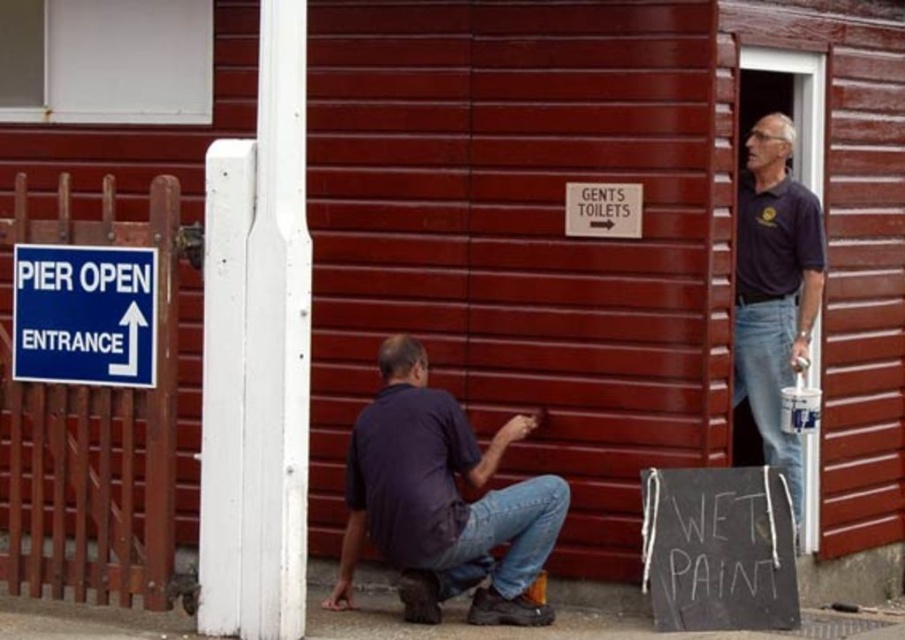
You are standing in front of the wooden building and want to read the blue plastic sign at upper left. Is the dark blue shirt at upper right blocking your view of the sign?

The dark blue shirt at upper right is further to the viewer than the blue plastic sign at upper left, so the dark blue shirt at upper right is closer to you and would block your view of the blue plastic sign at upper left.

You are a painter working on the red wooden structure. You notice the matte dark blue shirt at center and the blue plastic sign at upper left. Which object is wider from your current viewpoint?

The matte dark blue shirt at center might be wider than blue plastic sign at upper left according to the description.